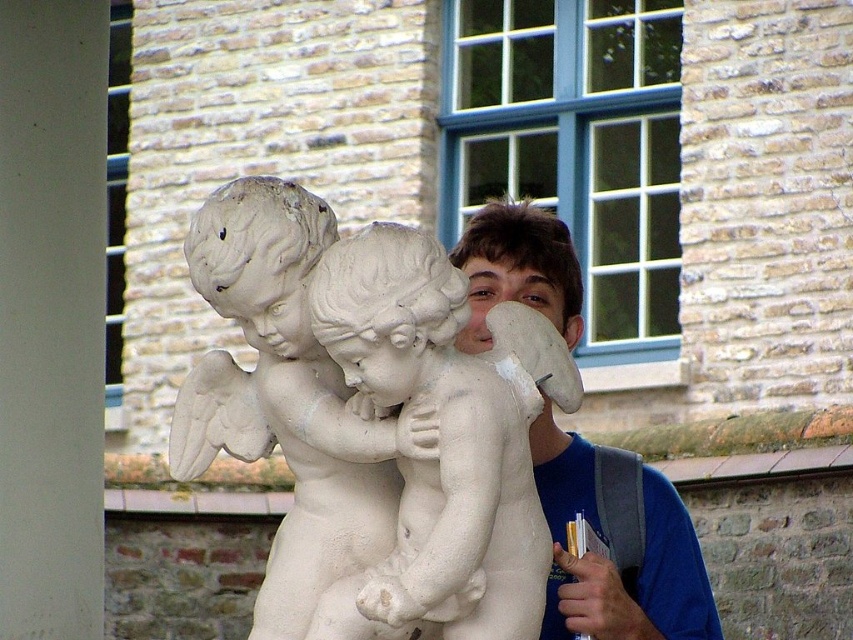
Question: Does white stone cherubs at center appear over blue matte shirt at center?

Choices:
 (A) yes
 (B) no

Answer: (B)

Question: Can you confirm if white stone cherubs at center is smaller than blue matte shirt at center?

Choices:
 (A) no
 (B) yes

Answer: (A)

Question: Among these points, which one is farthest from the camera?

Choices:
 (A) (300, 442)
 (B) (517, 246)

Answer: (B)

Question: Which of the following is the closest to the observer?

Choices:
 (A) white stone cherubs at center
 (B) blue matte shirt at center

Answer: (A)

Question: Which object is farther from the camera taking this photo?

Choices:
 (A) white stone cherubs at center
 (B) blue matte shirt at center

Answer: (B)

Question: Can you confirm if white stone cherubs at center is positioned to the right of blue matte shirt at center?

Choices:
 (A) no
 (B) yes

Answer: (A)